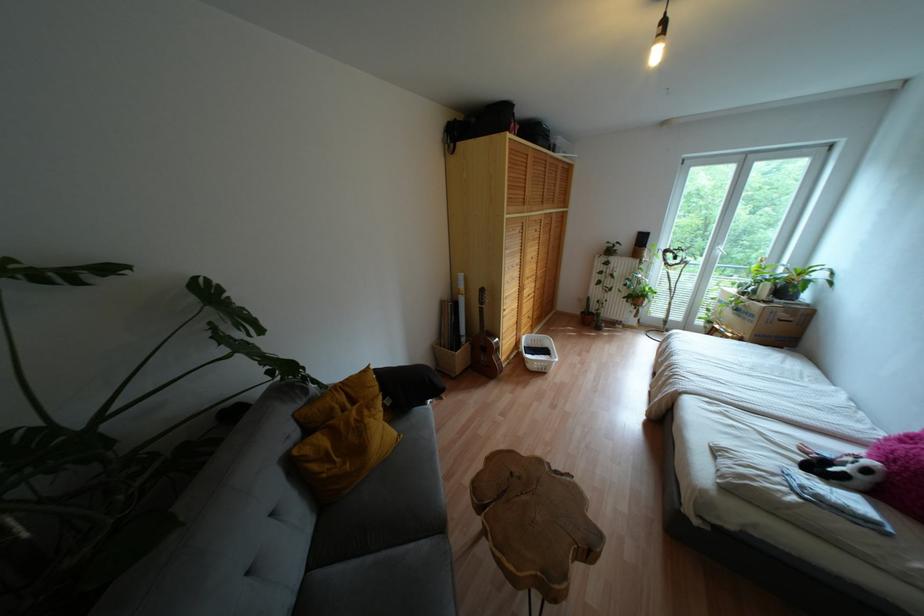
Which object does [878,471] point to?

It corresponds to the small stuffed animal in the image.